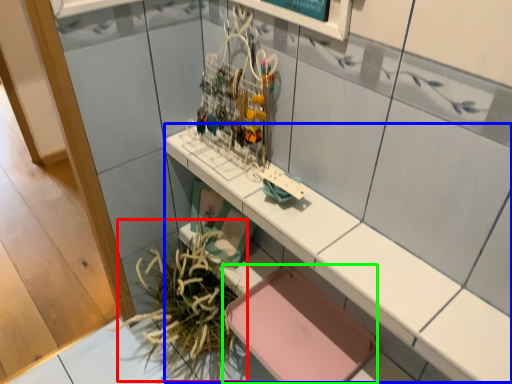
Question: Estimate the real-world distances between objects in this image. Which object is farther from plant (highlighted by a red box), counter (highlighted by a blue box) or chair (highlighted by a green box)?

Choices:
 (A) counter
 (B) chair

Answer: (A)